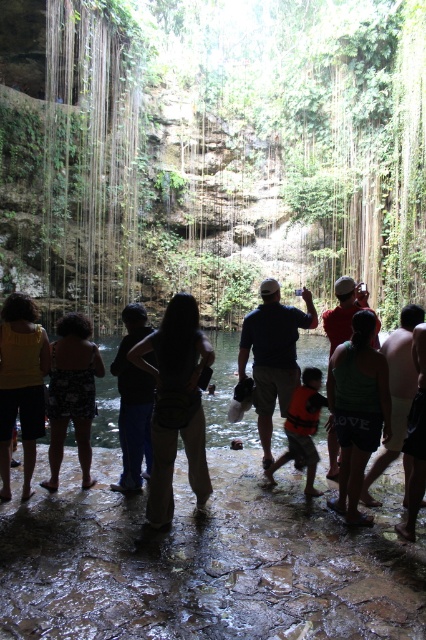
You are a photographer at the cenote and want to capture both the green fabric tank top at center and the dark blue jeans at center in the same frame. Which direction should you move your camera to include both?

Since the green fabric tank top at center is to the right of dark blue jeans at center, you should move your camera slightly to the right to ensure both the green fabric tank top at center and the dark blue jeans at center are in frame.

You are a photographer at the cenote and want to capture a photo of the tan skin person at center and the orange life vest at center. Which object will appear larger in the photo?

The tan skin person at center will appear larger in the photo because they are taller than the orange life vest at center.

You are part of the group at the cenote and want to locate the orange life vest at center quickly. Which direction should you look relative to the tan skin person at center?

The orange life vest at center is to the left of the tan skin person at center, so you should look to the left of the tan skin person at center to find it.